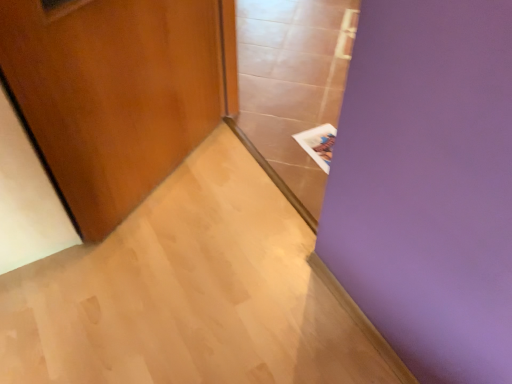
The width and height of the screenshot is (512, 384). What are the coordinates of `vacant position to the left of white paper at upper right` in the screenshot? It's located at (280, 142).